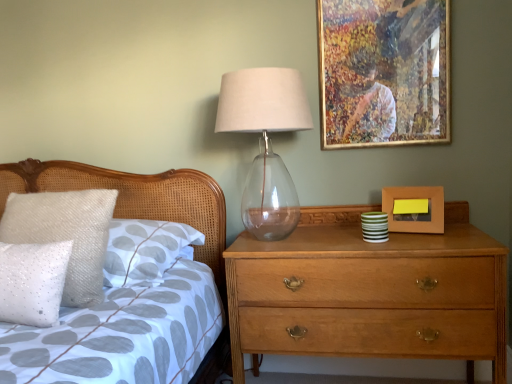
Question: Should I look upward or downward to see transparent glass table lamp at upper center?

Choices:
 (A) down
 (B) up

Answer: (B)

Question: Can you confirm if white sequined pillow at left, which is the first pillow from back to front, is taller than light brown wooden chest of drawers at right?

Choices:
 (A) yes
 (B) no

Answer: (B)

Question: Considering the relative positions of white sequined pillow at left, which is the first pillow from back to front, and light brown wooden chest of drawers at right in the image provided, is white sequined pillow at left, which is the first pillow from back to front, to the left of light brown wooden chest of drawers at right from the viewer's perspective?

Choices:
 (A) yes
 (B) no

Answer: (A)

Question: Are white sequined pillow at left, which is the first pillow from back to front, and light brown wooden chest of drawers at right located far from each other?

Choices:
 (A) no
 (B) yes

Answer: (A)

Question: Is white sequined pillow at left, which is the first pillow from back to front, positioned with its back to light brown wooden chest of drawers at right?

Choices:
 (A) no
 (B) yes

Answer: (A)

Question: Is white sequined pillow at left, which is the 2th pillow from front to back, at the right side of light brown wooden chest of drawers at right?

Choices:
 (A) yes
 (B) no

Answer: (B)

Question: Would you say white sequined pillow at left, which is the 2th pillow from front to back, is outside light brown wooden chest of drawers at right?

Choices:
 (A) yes
 (B) no

Answer: (A)

Question: Does white sequined pillow at left, which is the 1th pillow in front-to-back order, have a lesser height compared to white sequined pillow at left, which is the first pillow from back to front?

Choices:
 (A) no
 (B) yes

Answer: (B)

Question: From a real-world perspective, does white sequined pillow at left, the second pillow from the back, stand above white sequined pillow at left, which is the 2th pillow from front to back?

Choices:
 (A) yes
 (B) no

Answer: (B)

Question: Can you confirm if white sequined pillow at left, the second pillow from the back, is smaller than white sequined pillow at left, which is the first pillow from back to front?

Choices:
 (A) yes
 (B) no

Answer: (A)

Question: Can you confirm if white sequined pillow at left, the second pillow from the back, is wider than white sequined pillow at left, which is the first pillow from back to front?

Choices:
 (A) no
 (B) yes

Answer: (A)

Question: Does white sequined pillow at left, which is the 1th pillow in front-to-back order, come behind white sequined pillow at left, which is the first pillow from back to front?

Choices:
 (A) no
 (B) yes

Answer: (A)

Question: Can you confirm if white sequined pillow at left, which is the 1th pillow in front-to-back order, is thinner than white sequined pillow at left, which is the first pillow from back to front?

Choices:
 (A) yes
 (B) no

Answer: (A)

Question: Is gold-framed artwork at upper right, which ranks as the 2th picture frame in bottom-to-top order, a part of wooden picture frame at right, which is the 1th picture frame in bottom-to-top order?

Choices:
 (A) yes
 (B) no

Answer: (B)